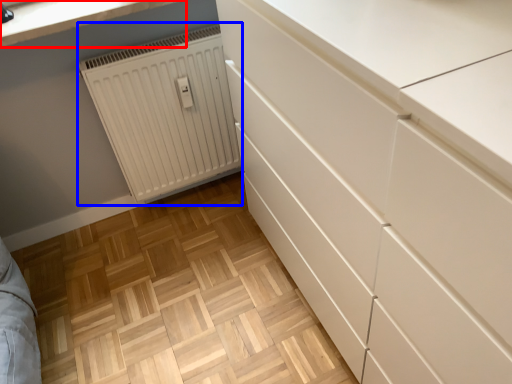
Question: Which of the following is the farthest to the observer, countertop (highlighted by a red box) or radiator (highlighted by a blue box)?

Choices:
 (A) countertop
 (B) radiator

Answer: (B)